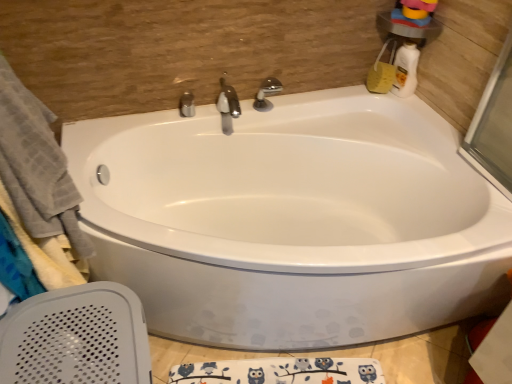
Find the location of a particular element. The width and height of the screenshot is (512, 384). free location to the left of polished chrome faucet at center, acting as the third tap starting from the right is located at coordinates (149, 122).